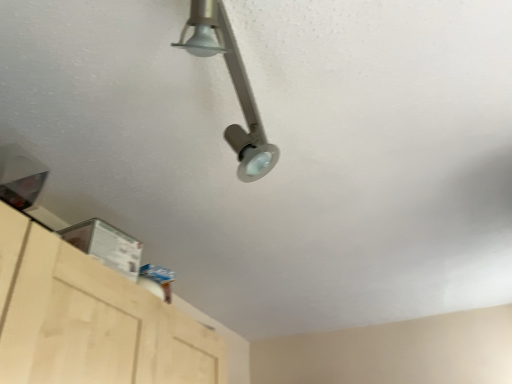
Question: Should I look upward or downward to see satin nickel track light at upper center?

Choices:
 (A) down
 (B) up

Answer: (B)

Question: Does satin nickel track light at upper center have a lesser height compared to light wood cabinet at lower left?

Choices:
 (A) no
 (B) yes

Answer: (B)

Question: Are satin nickel track light at upper center and light wood cabinet at lower left located far from each other?

Choices:
 (A) yes
 (B) no

Answer: (B)

Question: Does satin nickel track light at upper center appear on the right side of light wood cabinet at lower left?

Choices:
 (A) yes
 (B) no

Answer: (A)

Question: From the image's perspective, would you say satin nickel track light at upper center is shown under light wood cabinet at lower left?

Choices:
 (A) yes
 (B) no

Answer: (B)

Question: Can you confirm if satin nickel track light at upper center is positioned to the left of light wood cabinet at lower left?

Choices:
 (A) yes
 (B) no

Answer: (B)

Question: Is satin nickel track light at upper center outside of light wood cabinet at lower left?

Choices:
 (A) no
 (B) yes

Answer: (B)

Question: Does light wood cabinet at lower left have a greater width compared to satin nickel track light at upper center?

Choices:
 (A) yes
 (B) no

Answer: (A)

Question: Would you say light wood cabinet at lower left contains satin nickel track light at upper center?

Choices:
 (A) no
 (B) yes

Answer: (A)

Question: Is light wood cabinet at lower left positioned before satin nickel track light at upper center?

Choices:
 (A) no
 (B) yes

Answer: (A)

Question: Considering the relative sizes of light wood cabinet at lower left and satin nickel track light at upper center in the image provided, is light wood cabinet at lower left bigger than satin nickel track light at upper center?

Choices:
 (A) yes
 (B) no

Answer: (A)

Question: From the image's perspective, does light wood cabinet at lower left appear lower than satin nickel track light at upper center?

Choices:
 (A) yes
 (B) no

Answer: (A)

Question: Is light wood cabinet at lower left outside satin nickel track light at upper center?

Choices:
 (A) yes
 (B) no

Answer: (A)

Question: From a real-world perspective, is satin nickel track light at upper center positioned above or below light wood cabinet at lower left?

Choices:
 (A) below
 (B) above

Answer: (B)